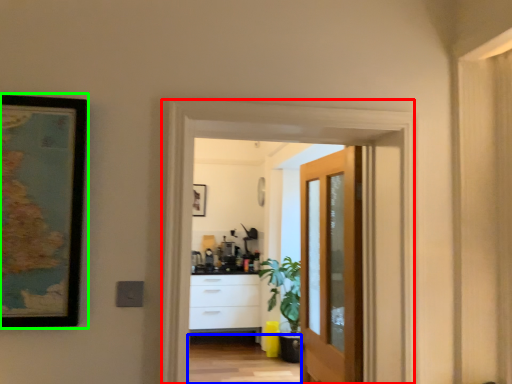
Question: Based on their relative distances, which object is nearer to screen door (highlighted by a red box)? Choose from path (highlighted by a blue box) and picture frame (highlighted by a green box).

Choices:
 (A) path
 (B) picture frame

Answer: (B)